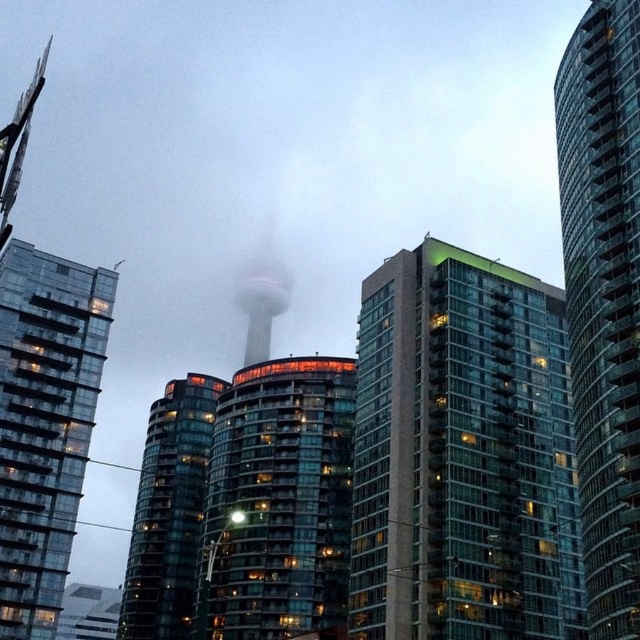
Question: Among these objects, which one is farthest from the camera?

Choices:
 (A) foggy glass cn tower at center
 (B) glassy reflective building at center

Answer: (A)

Question: Can you confirm if glassy reflective tower at center is positioned to the right of foggy glass cn tower at center?

Choices:
 (A) yes
 (B) no

Answer: (A)

Question: Which object is the closest to the transparent glass building at left?

Choices:
 (A) transparent glass tower at center
 (B) glassy reflective tower at center
 (C) glassy reflective building at center
 (D) glassy concrete building at center

Answer: (C)

Question: Observing the image, what is the correct spatial positioning of glassy concrete building at center in reference to transparent glass tower at center?

Choices:
 (A) right
 (B) left

Answer: (B)

Question: Which of the following is the closest to the observer?

Choices:
 (A) transparent glass tower at center
 (B) glassy concrete building at center

Answer: (A)

Question: Does transparent glass building at left have a lesser width compared to glassy reflective tower at center?

Choices:
 (A) no
 (B) yes

Answer: (B)